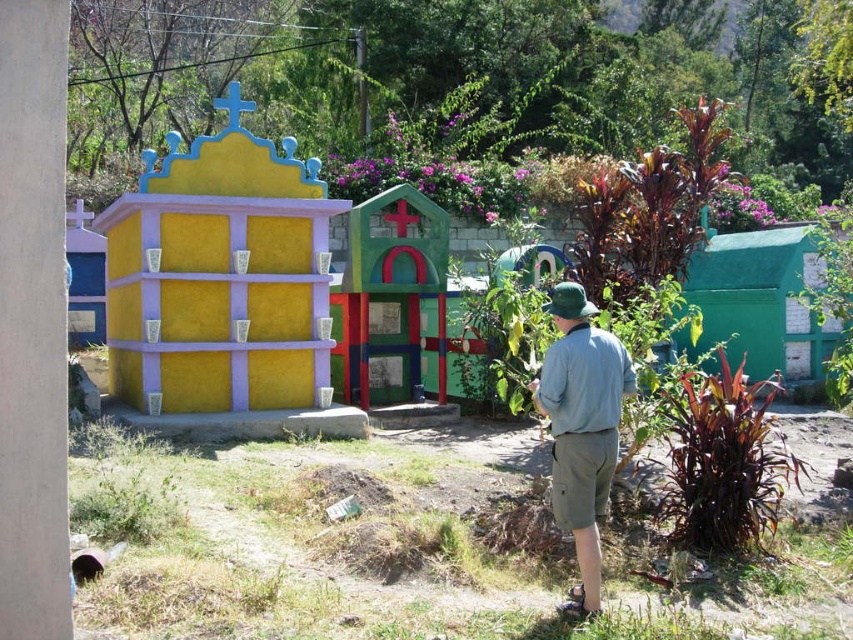
Question: Does green cotton shirt at center come behind matte yellow wall at left?

Choices:
 (A) no
 (B) yes

Answer: (A)

Question: Is yellow matte/beige wall at upper left thinner than green cotton shirt at center?

Choices:
 (A) yes
 (B) no

Answer: (B)

Question: Which object is the farthest from the yellow matte/beige wall at upper left?

Choices:
 (A) green matte/tile hut at right
 (B) matte yellow wall at left
 (C) green cotton shirt at center
 (D) multicolored painted wooden house at center

Answer: (A)

Question: Considering the real-world distances, which object is closest to the multicolored painted wooden house at center?

Choices:
 (A) yellow matte/beige wall at upper left
 (B) green cotton shirt at center
 (C) matte yellow wall at left

Answer: (A)

Question: Which object appears farthest from the camera in this image?

Choices:
 (A) green matte/tile hut at right
 (B) matte yellow wall at left
 (C) multicolored painted wooden house at center

Answer: (B)

Question: Does yellow matte/beige wall at upper left appear under matte yellow wall at left?

Choices:
 (A) yes
 (B) no

Answer: (A)